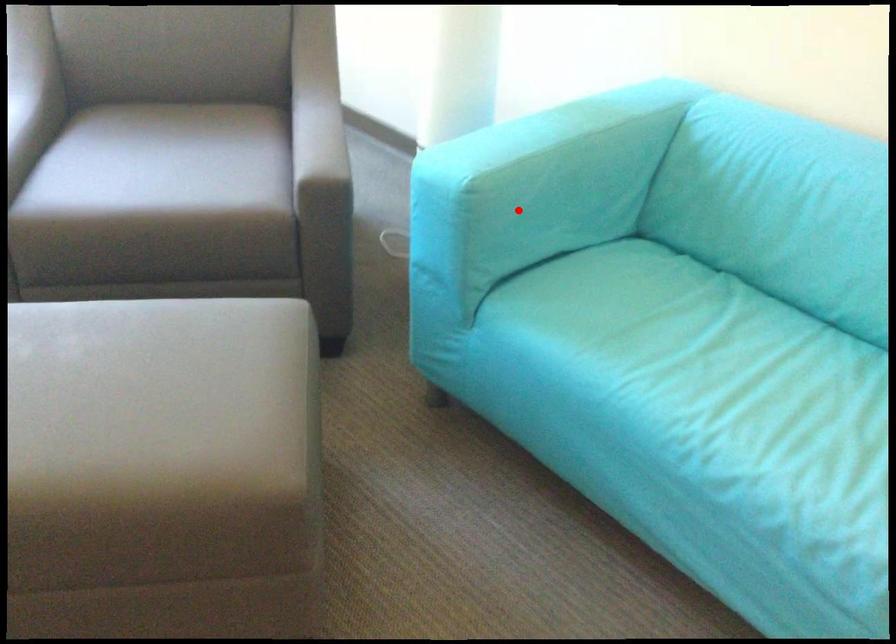
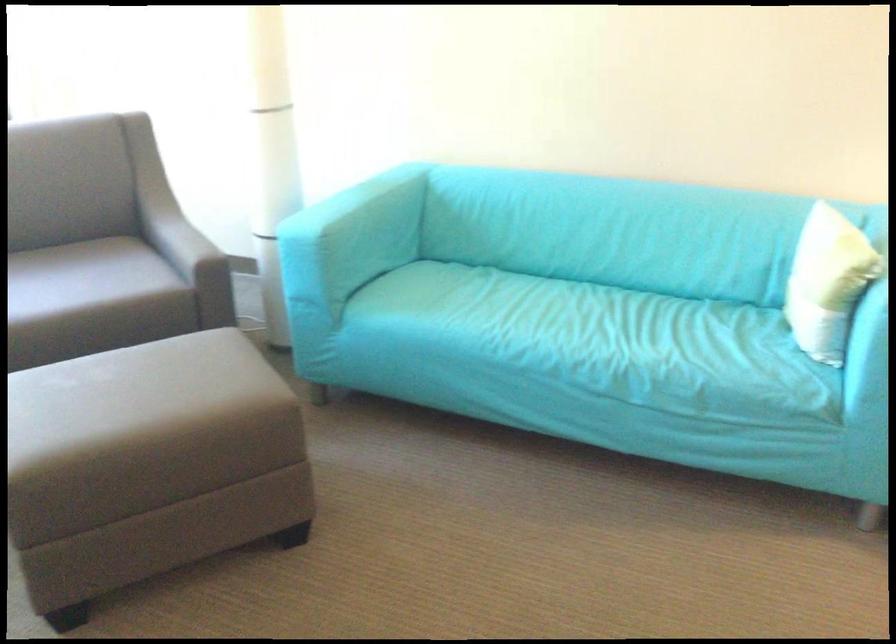
Question: I am providing you with two images of the same scene from different viewpoints. Given a red point in image1, look at the same physical point in image2. Is it:

Choices:
 (A) Closer to the viewpoint
 (B) Farther from the viewpoint

Answer: (B)